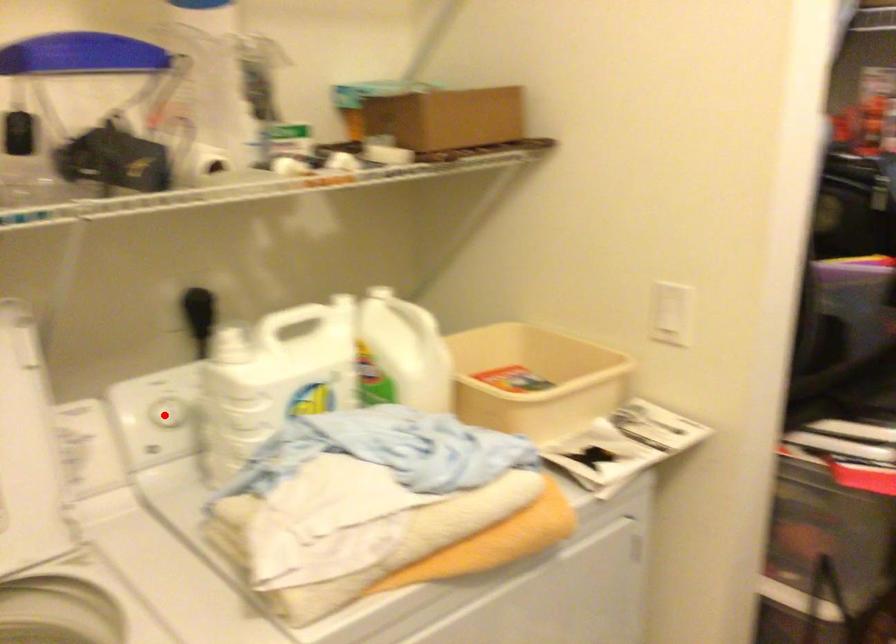
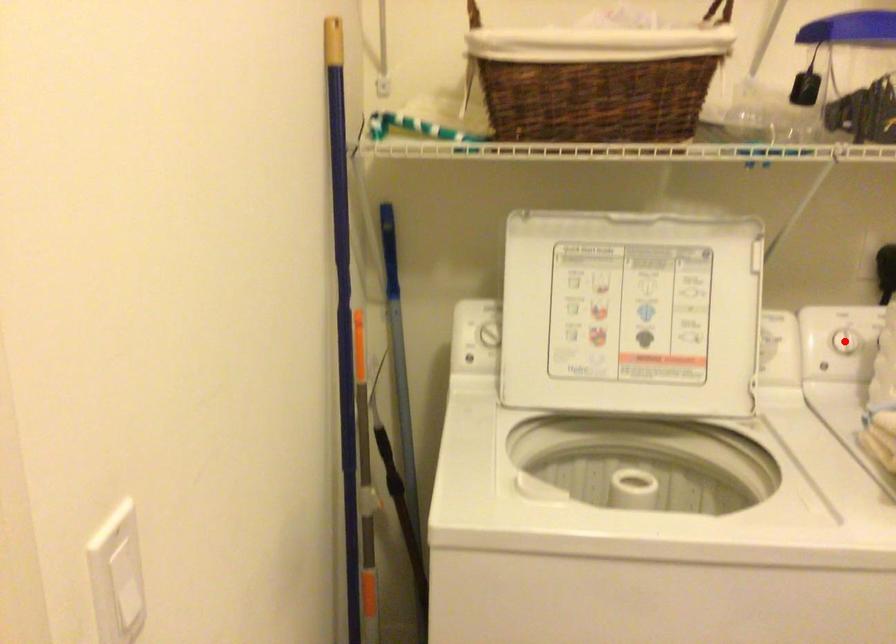
I am providing you with two images of the same scene from different viewpoints. A red point is marked on the first image and another point is marked on the second image. Is the red point in image1 aligned with the point shown in image2?

Yes